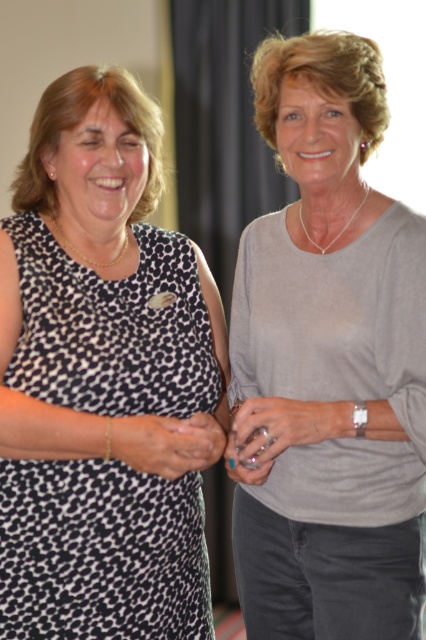
Which is behind, point (23, 253) or point (402, 563)?

Point (402, 563)

This screenshot has height=640, width=426. Identify the location of black leopard print dress at left. (103, 380).